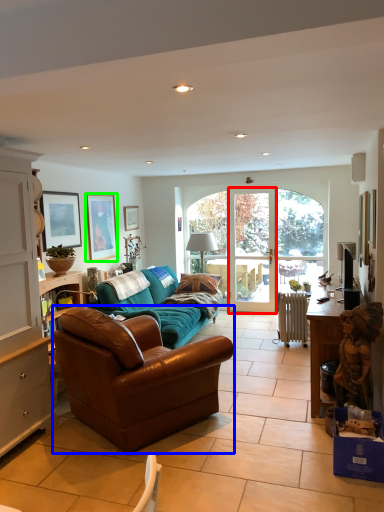
Question: Based on their relative distances, which object is nearer to screen door (highlighted by a red box)? Choose from studio couch (highlighted by a blue box) and picture frame (highlighted by a green box).

Choices:
 (A) studio couch
 (B) picture frame

Answer: (B)